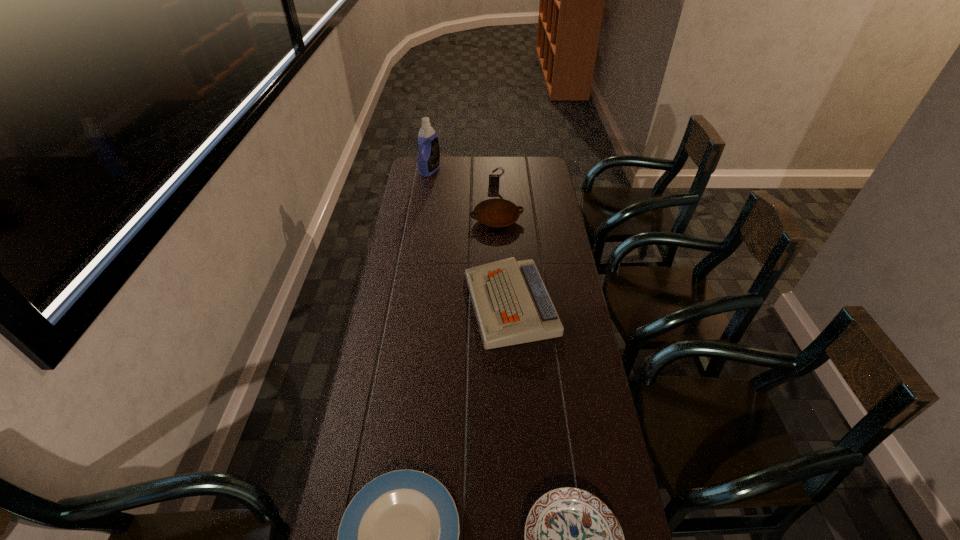
Where is `the tallest object`? Image resolution: width=960 pixels, height=540 pixels. the tallest object is located at coordinates (428, 160).

Locate an element on the screen. The image size is (960, 540). detergent is located at coordinates (428, 160).

I want to click on the second farthest object, so click(493, 178).

Locate an element on the screen. the second tallest object is located at coordinates (493, 178).

At what (x,y) coordinates should I click in order to perform the action: click on computer keyboard. Please return your answer as a coordinate pair (x, y). Looking at the image, I should click on (511, 304).

Where is `the third tallest object`? the third tallest object is located at coordinates (511, 304).

Where is `the fourth tallest object`? the fourth tallest object is located at coordinates (496, 212).

Locate an element on the screen. The image size is (960, 540). the tallest plate is located at coordinates (496, 212).

Locate an element on the screen. free spot located on the front of the tallest object is located at coordinates (425, 198).

Locate an element on the screen. The width and height of the screenshot is (960, 540). vacant region located with the keyhole on the front of the second tallest object is located at coordinates (498, 219).